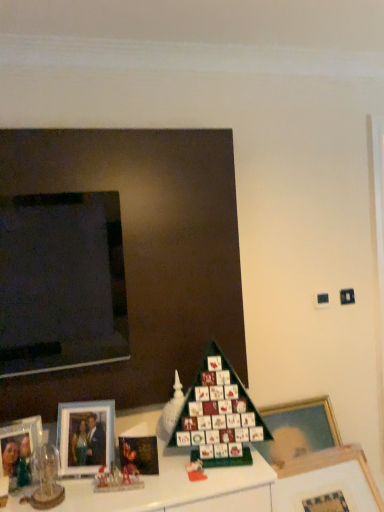
Question: Considering the positions of point (66, 418) and point (152, 454), is point (66, 418) closer or farther from the camera than point (152, 454)?

Choices:
 (A) farther
 (B) closer

Answer: (A)

Question: Considering their positions, is matte silver picture frame at lower left, the third picture frame positioned from the right, located in front of or behind matte black picture frame at lower left, acting as the 2th picture frame starting from the right?

Choices:
 (A) front
 (B) behind

Answer: (B)

Question: Considering the real-world distances, which object is closest to the matte black picture frame at lower left, acting as the 2th picture frame starting from the right?

Choices:
 (A) matte silver picture frame at lower left, the third picture frame positioned from the right
 (B) clear glass photo frame at lower left, which is the fourth picture frame from right to left
 (C) wooden photo frame at lower left
 (D) wooden picture frame at lower right, which ranks as the 4th picture frame in left-to-right order
 (E) green cardboard christmas tree at center

Answer: (A)

Question: Estimate the real-world distances between objects in this image. Which object is closer to the matte silver picture frame at lower left, the third picture frame positioned from the right?

Choices:
 (A) matte plastic toy at lower center
 (B) wooden picture frame at lower right, which ranks as the 4th picture frame in left-to-right order
 (C) wooden photo frame at lower left
 (D) matte black picture frame at lower left, acting as the 2th picture frame starting from the right
 (E) green cardboard christmas tree at center

Answer: (D)